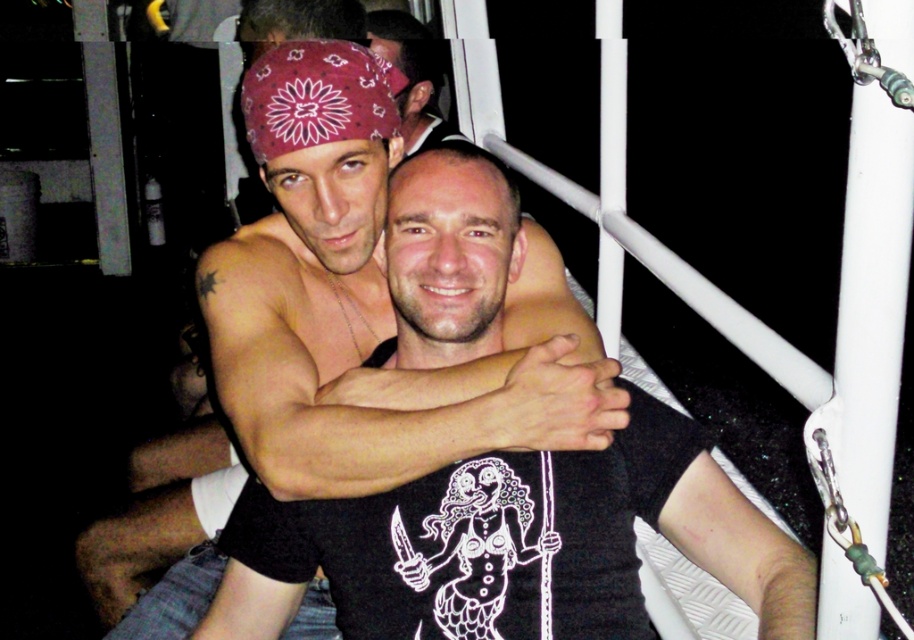
You are a photographer setting up for a portrait. You notice the matte black shirt at center and the matte black bandana at upper center in the frame. Which object should you adjust to ensure the bandana is above the shirt in the final photo?

The matte black shirt at center is located below the matte black bandana at upper center, so to ensure the bandana remains above the shirt, you should adjust the position of the matte black shirt at center upwards or the bandana downwards if needed.

You are standing in a dark room and need to locate the matte black shirt at center. Based on the coordinates provided, where should you look to find it?

The matte black shirt at center is located at coordinates point (512,545).